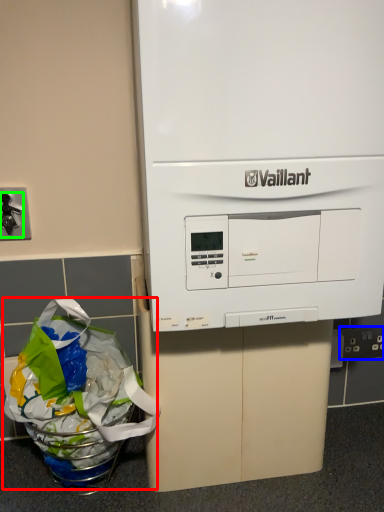
Question: Considering the real-world distances, which object is closest to grocery bag (highlighted by a red box)? electric outlet (highlighted by a blue box) or faucet (highlighted by a green box).

Choices:
 (A) electric outlet
 (B) faucet

Answer: (B)